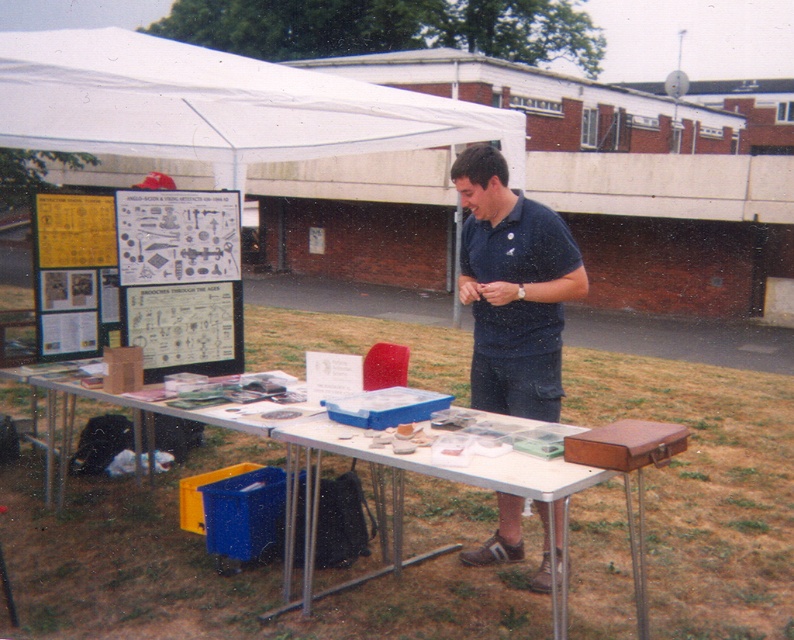
Question: Which point appears farthest from the camera in this image?

Choices:
 (A) (216, 65)
 (B) (505, 458)
 (C) (542, 204)

Answer: (C)

Question: Does white fabric canopy at upper left have a smaller size compared to dark blue shirt at center?

Choices:
 (A) no
 (B) yes

Answer: (A)

Question: Which of the following is the farthest from the observer?

Choices:
 (A) (498, 268)
 (B) (476, 362)
 (C) (430, 472)

Answer: (B)

Question: Which point appears closest to the camera in this image?

Choices:
 (A) (513, 324)
 (B) (475, 401)

Answer: (A)

Question: Is dark blue shirt at center closer to camera compared to dark blue cotton polo shirt at center?

Choices:
 (A) no
 (B) yes

Answer: (A)

Question: Is matte plastic table at center to the left of dark blue cotton polo shirt at center from the viewer's perspective?

Choices:
 (A) yes
 (B) no

Answer: (A)